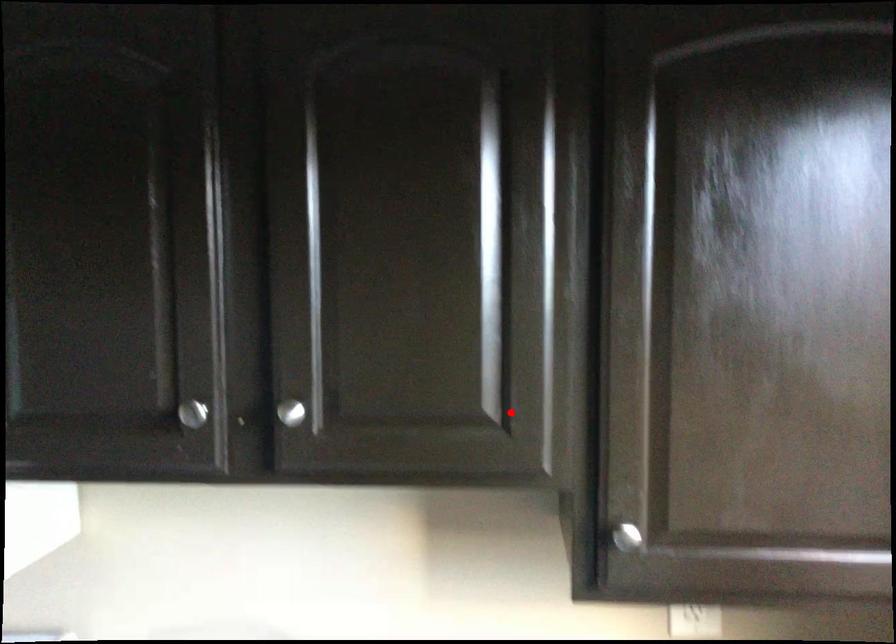
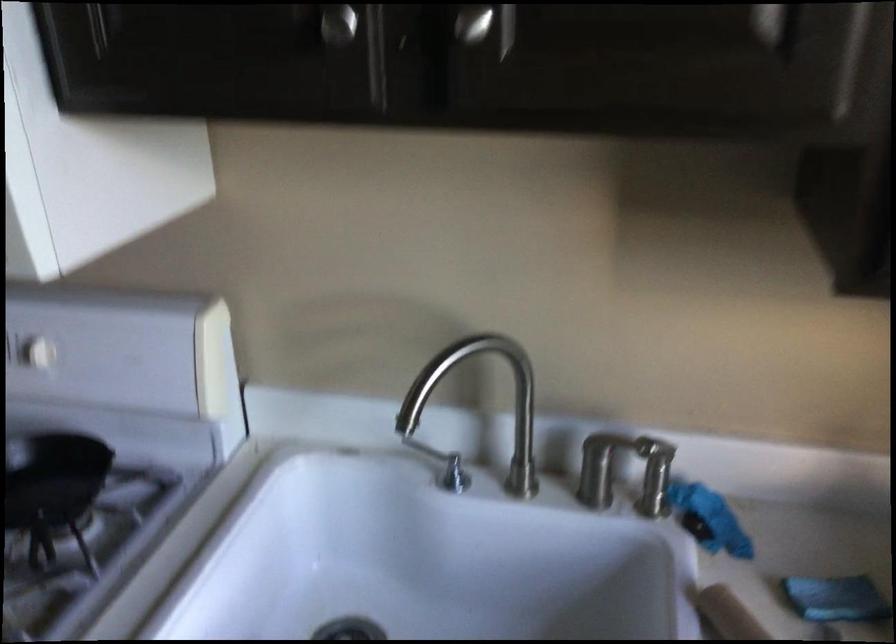
The point at the highlighted location is marked in the first image. Where is the corresponding point in the second image?

(794, 24)